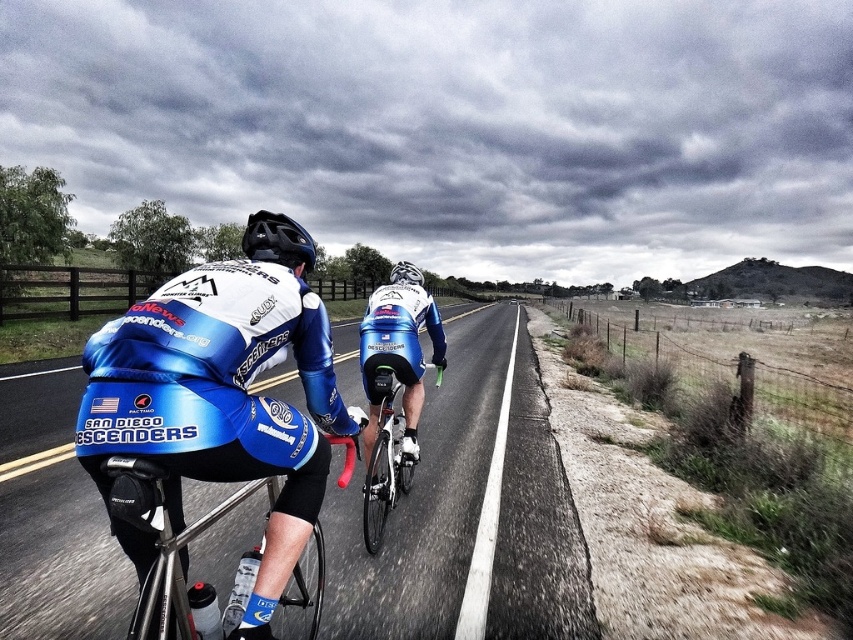
Question: Where is shiny black frame at center located in relation to shiny metallic bicycle at center in the image?

Choices:
 (A) right
 (B) left

Answer: (B)

Question: Which object is closer to the camera taking this photo?

Choices:
 (A) white matte bicycle helmet at center
 (B) shiny black frame at center
 (C) shiny metallic bicycle at center

Answer: (B)

Question: Which object is the closest to the white matte bicycle helmet at center?

Choices:
 (A) shiny metallic bicycle at center
 (B) matte black helmet at center
 (C) shiny black road at center

Answer: (B)

Question: Does matte black helmet at center have a greater width compared to white matte bicycle helmet at center?

Choices:
 (A) yes
 (B) no

Answer: (A)

Question: Is shiny black road at center thinner than shiny black frame at center?

Choices:
 (A) yes
 (B) no

Answer: (B)

Question: Which of the following is the closest to the observer?

Choices:
 (A) (415, 276)
 (B) (506, 452)
 (C) (372, 506)

Answer: (C)